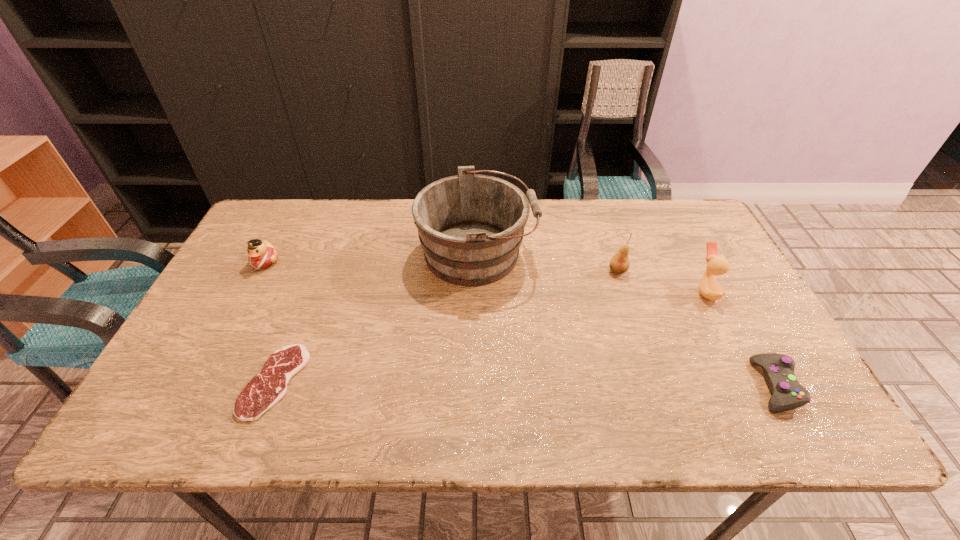
Image resolution: width=960 pixels, height=540 pixels. Find the location of `free space between the fifth object from right to left and the right duck`. free space between the fifth object from right to left and the right duck is located at coordinates (491, 336).

Where is `free space that is in between the third object from left to right and the fifth tallest object`? Image resolution: width=960 pixels, height=540 pixels. free space that is in between the third object from left to right and the fifth tallest object is located at coordinates (626, 320).

Identify the location of free area in between the shortest object and the right duck. This screenshot has height=540, width=960. (491, 336).

Locate an element on the screen. free space between the shortest object and the nearer duck is located at coordinates (491, 336).

Identify the location of vacant point located between the second shortest object and the second object from left to right. (524, 383).

Identify the location of blank region between the control and the leftmost object. This screenshot has width=960, height=540. [519, 323].

At what (x,y) coordinates should I click in order to perform the action: click on free space between the second shortest object and the taller duck. Please return your answer as a coordinate pair (x, y). Looking at the image, I should click on (740, 338).

I want to click on object that is the third closest to the shorter duck, so click(x=619, y=263).

Where is `object that stands as the second closest to the tallest object`? The width and height of the screenshot is (960, 540). object that stands as the second closest to the tallest object is located at coordinates (269, 386).

Find the location of a particular element. vacant space that satisfies the following two spatial constraints: 1. on the face of the leftmost object; 2. on the left side of the pear is located at coordinates (260, 271).